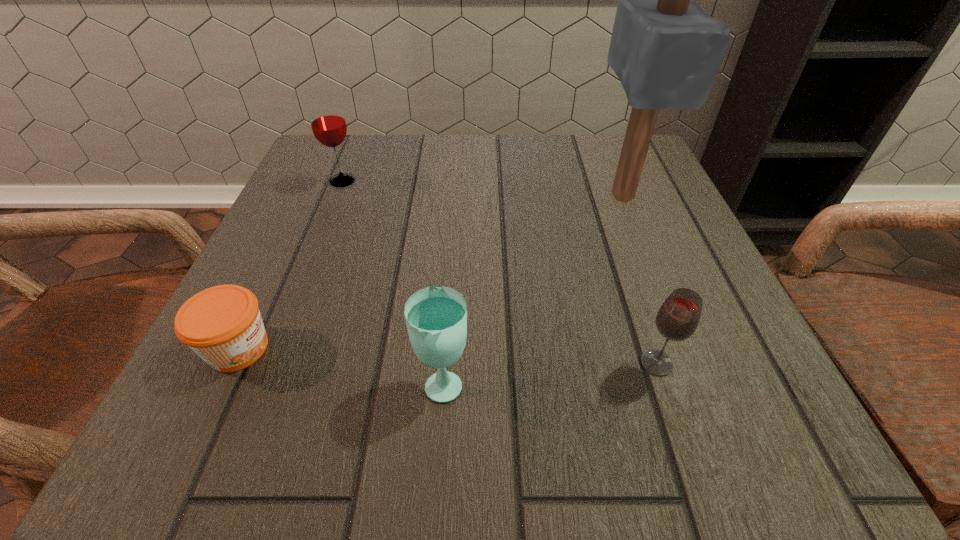
Identify the location of mallet. Image resolution: width=960 pixels, height=540 pixels. (666, 51).

Where is `the farthest glass drink container`? The image size is (960, 540). the farthest glass drink container is located at coordinates (328, 124).

Image resolution: width=960 pixels, height=540 pixels. What are the coordinates of `the second glass drink container from right to left` in the screenshot? It's located at (436, 317).

Locate an element on the screen. Image resolution: width=960 pixels, height=540 pixels. the rightmost glass drink container is located at coordinates (677, 319).

Locate an element on the screen. jam is located at coordinates (222, 324).

At what (x,y) coordinates should I click in order to perform the action: click on vacant space located on the left of the tallest object. Please return your answer as a coordinate pair (x, y). This screenshot has width=960, height=540. Looking at the image, I should click on (563, 195).

Where is `vacant space situated 0.120m on the back of the farthest glass drink container`? vacant space situated 0.120m on the back of the farthest glass drink container is located at coordinates (357, 144).

Where is `vacant space located 0.170m on the left of the second glass drink container from right to left`? The width and height of the screenshot is (960, 540). vacant space located 0.170m on the left of the second glass drink container from right to left is located at coordinates (286, 381).

Identify the location of free location located 0.380m on the back of the rightmost glass drink container. (599, 192).

Where is `vacant area located on the front label of the shortest object`? vacant area located on the front label of the shortest object is located at coordinates (318, 348).